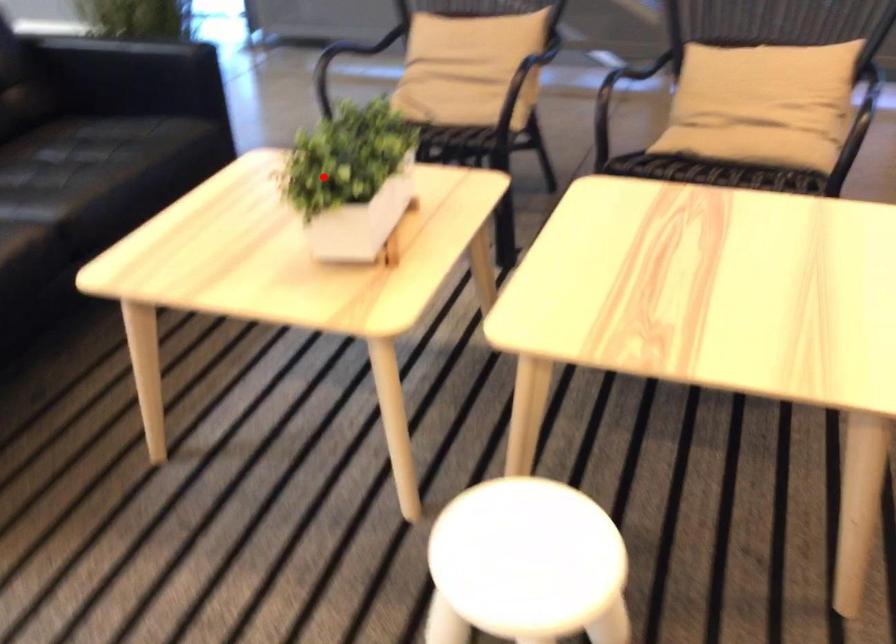
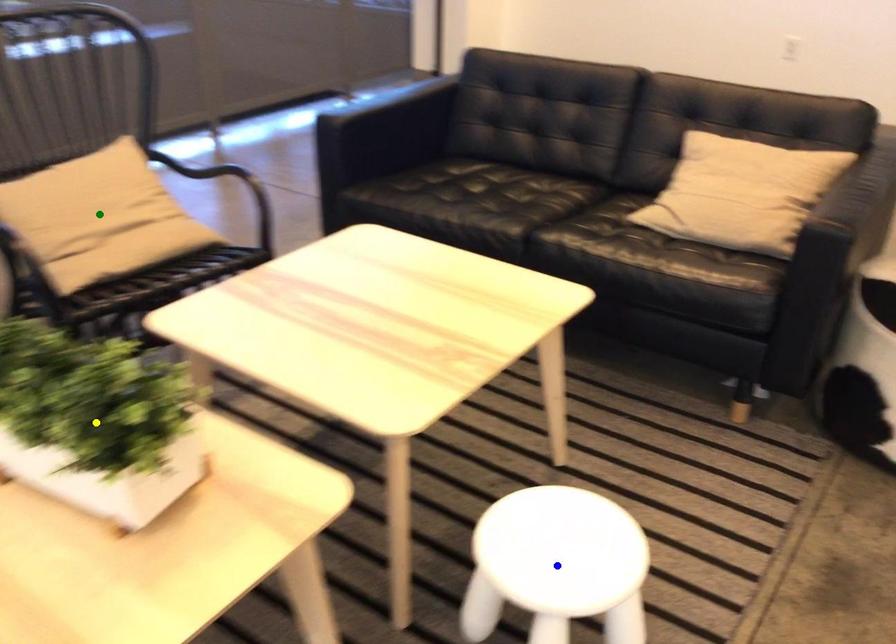
Question: I am providing you with two images of the same scene from different viewpoints. A red point is marked on the first image. You are given multiple points on the second image. Can you choose the point in image 2 that corresponds to the point in image 1?

Choices:
 (A) green point
 (B) blue point
 (C) yellow point

Answer: (C)